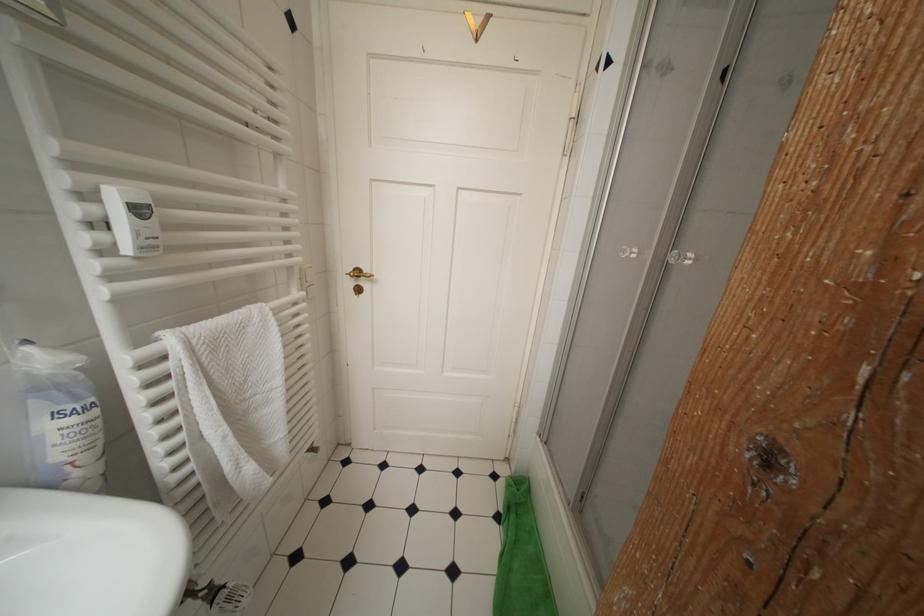
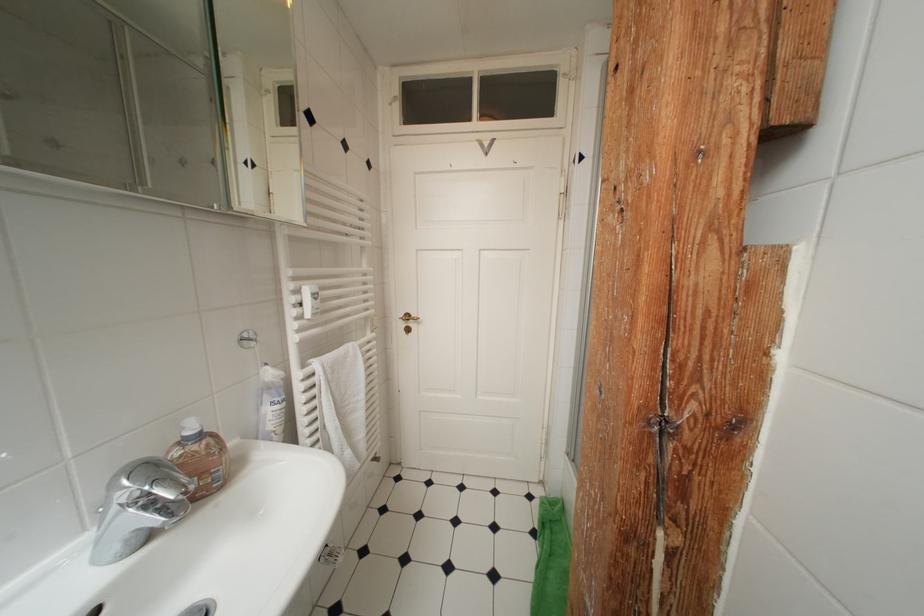
Locate, in the second image, the point that corresponds to point (177, 342) in the first image.

(322, 368)